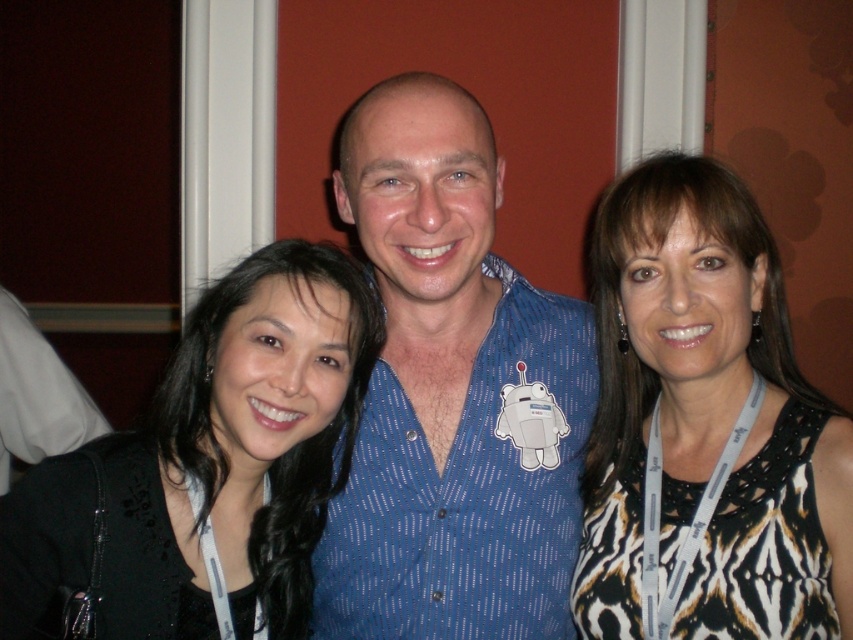
Question: Does blue dotted shirt at center have a larger size compared to printed fabric dress at right?

Choices:
 (A) yes
 (B) no

Answer: (A)

Question: Which of the following is the farthest from the observer?

Choices:
 (A) printed fabric dress at right
 (B) white fabric at left

Answer: (B)

Question: Is printed fabric dress at right positioned in front of black fabric at left?

Choices:
 (A) yes
 (B) no

Answer: (B)

Question: Which of the following is the farthest from the observer?

Choices:
 (A) (422, 120)
 (B) (199, 355)

Answer: (B)

Question: Is printed fabric dress at right above black fabric at left?

Choices:
 (A) no
 (B) yes

Answer: (B)

Question: Which object appears farthest from the camera in this image?

Choices:
 (A) printed fabric dress at right
 (B) black fabric at left
 (C) white fabric at left
 (D) blue dotted shirt at center

Answer: (C)